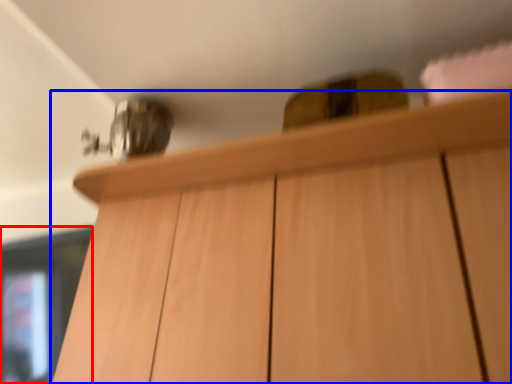
Question: Which point is further to the camera, glass door (highlighted by a red box) or cabinetry (highlighted by a blue box)?

Choices:
 (A) glass door
 (B) cabinetry

Answer: (A)